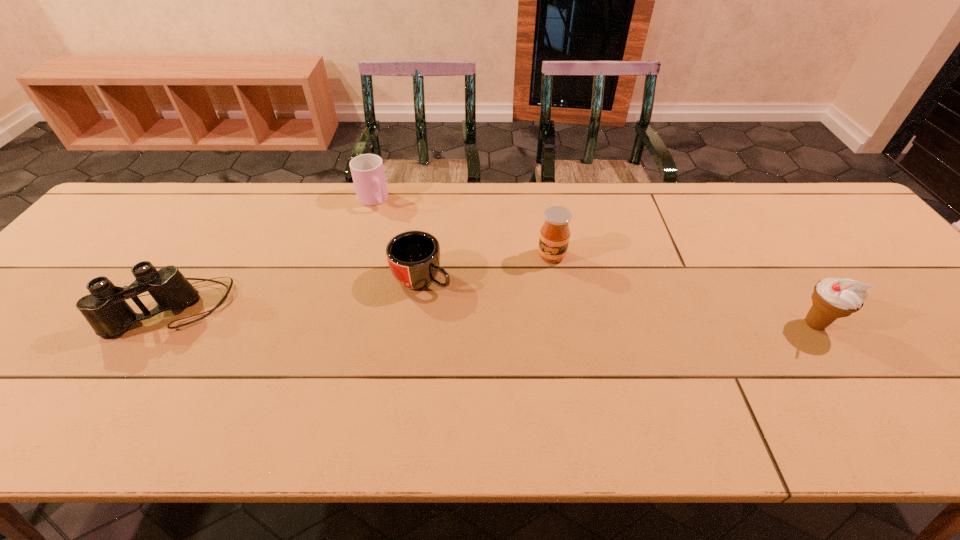
You are a GUI agent. You are given a task and a screenshot of the screen. Output one action in this format:
    pyautogui.click(x=<x>, y=<y>)
    Task: Click on the free spot between the cup and the second object from right to left
    
    Given the screenshot: What is the action you would take?
    pyautogui.click(x=463, y=228)

Find the location of a particular element. vacant space that's between the binoculars and the farthest object is located at coordinates (273, 254).

Where is `free space between the leftmost object and the mug`? The image size is (960, 540). free space between the leftmost object and the mug is located at coordinates (297, 293).

What are the coordinates of `object that stands as the third closest to the cup` in the screenshot? It's located at (554, 237).

Identify which object is the third nearest to the shortest object. Please provide its 2D coordinates. Your answer should be formatted as a tuple, i.e. [(x, y)], where the tuple contains the x and y coordinates of a point satisfying the conditions above.

[(105, 309)]

The width and height of the screenshot is (960, 540). I want to click on vacant space that satisfies the following two spatial constraints: 1. on the front side of the cup; 2. on the right side of the rightmost object, so click(x=339, y=324).

Locate an element on the screen. vacant space that satisfies the following two spatial constraints: 1. on the front side of the rightmost object; 2. on the left side of the leftmost object is located at coordinates (162, 324).

Where is `free region that satisfies the following two spatial constraints: 1. on the front side of the farthest object; 2. on the left side of the icecream`? This screenshot has width=960, height=540. free region that satisfies the following two spatial constraints: 1. on the front side of the farthest object; 2. on the left side of the icecream is located at coordinates (339, 324).

At what (x,y) coordinates should I click in order to perform the action: click on vacant space that satisfies the following two spatial constraints: 1. on the back side of the binoculars; 2. on the right side of the cup. Please return your answer as a coordinate pair (x, y). The width and height of the screenshot is (960, 540). Looking at the image, I should click on (240, 200).